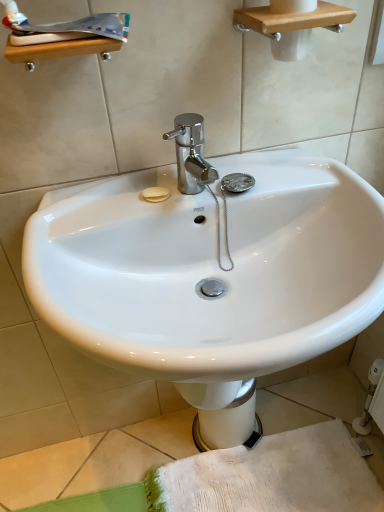
Question: From a real-world perspective, is white glossy toothpaste at upper left under white glossy bidet at center?

Choices:
 (A) no
 (B) yes

Answer: (A)

Question: From the image's perspective, is white glossy toothpaste at upper left located beneath white glossy bidet at center?

Choices:
 (A) yes
 (B) no

Answer: (B)

Question: Can you confirm if white glossy toothpaste at upper left is bigger than white glossy bidet at center?

Choices:
 (A) no
 (B) yes

Answer: (A)

Question: Is the depth of white glossy toothpaste at upper left less than that of white glossy bidet at center?

Choices:
 (A) yes
 (B) no

Answer: (A)

Question: Is white glossy toothpaste at upper left beside white glossy bidet at center?

Choices:
 (A) no
 (B) yes

Answer: (A)

Question: Would you say white glossy sink at center is to the left or to the right of white glossy toothpaste at upper left in the picture?

Choices:
 (A) left
 (B) right

Answer: (B)

Question: From their relative heights in the image, would you say white glossy sink at center is taller or shorter than white glossy toothpaste at upper left?

Choices:
 (A) short
 (B) tall

Answer: (B)

Question: Considering the positions of white glossy sink at center and white glossy toothpaste at upper left in the image, is white glossy sink at center wider or thinner than white glossy toothpaste at upper left?

Choices:
 (A) thin
 (B) wide

Answer: (B)

Question: Considering the positions of white glossy sink at center and white glossy toothpaste at upper left in the image, is white glossy sink at center bigger or smaller than white glossy toothpaste at upper left?

Choices:
 (A) big
 (B) small

Answer: (A)

Question: Based on their positions, is white glossy bidet at center located to the left or right of white glossy toothpaste at upper left?

Choices:
 (A) right
 (B) left

Answer: (A)

Question: Considering the positions of point (210, 412) and point (23, 32), is point (210, 412) closer or farther from the camera than point (23, 32)?

Choices:
 (A) farther
 (B) closer

Answer: (A)

Question: Is white glossy bidet at center inside or outside of white glossy toothpaste at upper left?

Choices:
 (A) inside
 (B) outside

Answer: (B)

Question: From the image's perspective, is white glossy bidet at center above or below white glossy toothpaste at upper left?

Choices:
 (A) below
 (B) above

Answer: (A)

Question: Is point (16, 26) positioned closer to the camera than point (205, 386)?

Choices:
 (A) farther
 (B) closer

Answer: (B)

Question: Is white glossy toothpaste at upper left situated inside white glossy bidet at center or outside?

Choices:
 (A) outside
 (B) inside

Answer: (A)